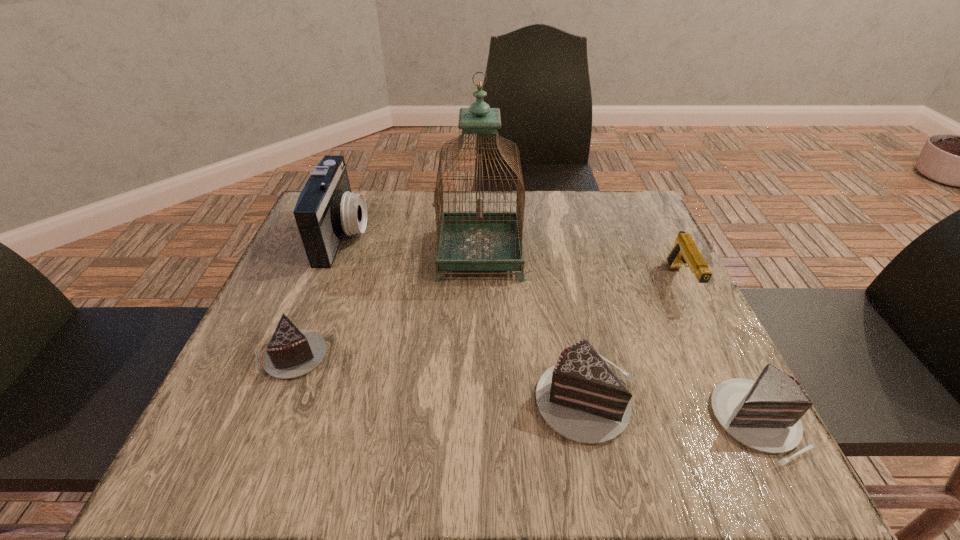
Identify the location of free point between the shortest object and the tallest object. The width and height of the screenshot is (960, 540). (385, 305).

Identify the location of free area in between the pistol and the rightmost chocolate cake. This screenshot has width=960, height=540. (718, 353).

This screenshot has width=960, height=540. What are the coordinates of `empty location between the shortest object and the tallest object` in the screenshot? It's located at click(x=385, y=305).

Locate an element on the screen. vacant point located between the pistol and the second chocolate cake from left to right is located at coordinates (634, 341).

Identify the location of empty space that is in between the tallest object and the pistol. (580, 268).

Identify the location of free space between the birdcage and the shortest chocolate cake. The image size is (960, 540). (385, 305).

The width and height of the screenshot is (960, 540). Find the location of `free space between the second tallest chocolate cake and the second chocolate cake from right to left`. free space between the second tallest chocolate cake and the second chocolate cake from right to left is located at coordinates (672, 410).

Locate an element on the screen. free spot between the rightmost chocolate cake and the tallest object is located at coordinates click(x=618, y=338).

What are the coordinates of `empty location between the shortest object and the second shortest chocolate cake` in the screenshot? It's located at (524, 389).

Point out which object is positioned as the fourth nearest to the birdcage. Please provide its 2D coordinates. Your answer should be formatted as a tuple, i.e. [(x, y)], where the tuple contains the x and y coordinates of a point satisfying the conditions above.

[(685, 252)]